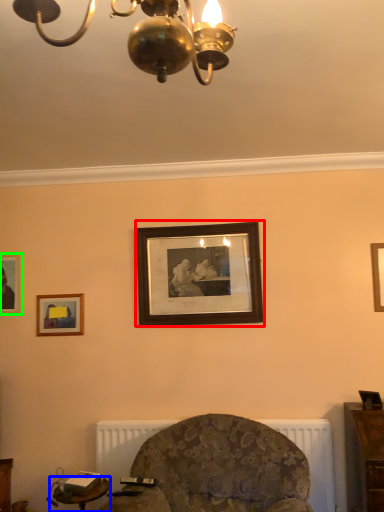
Question: Which is farther away from picture frame (highlighted by a red box)? table (highlighted by a blue box) or picture frame (highlighted by a green box)?

Choices:
 (A) table
 (B) picture frame

Answer: (A)